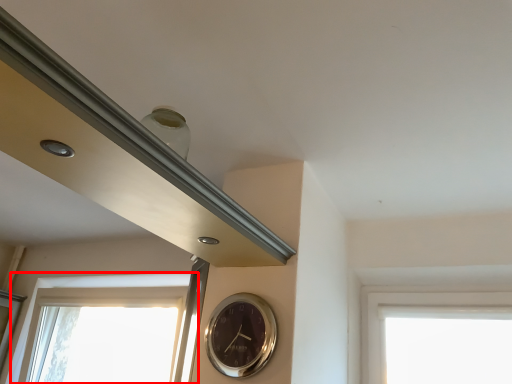
Question: Observing the image, what is the correct spatial positioning of window (annotated by the red box) in reference to wall clock?

Choices:
 (A) right
 (B) left

Answer: (B)